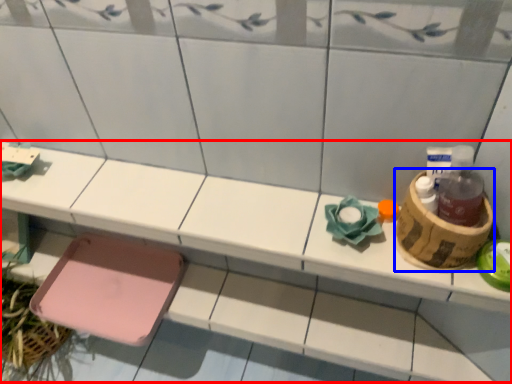
Question: Which object is further to the camera taking this photo, vanity (highlighted by a red box) or basket (highlighted by a blue box)?

Choices:
 (A) vanity
 (B) basket

Answer: (A)